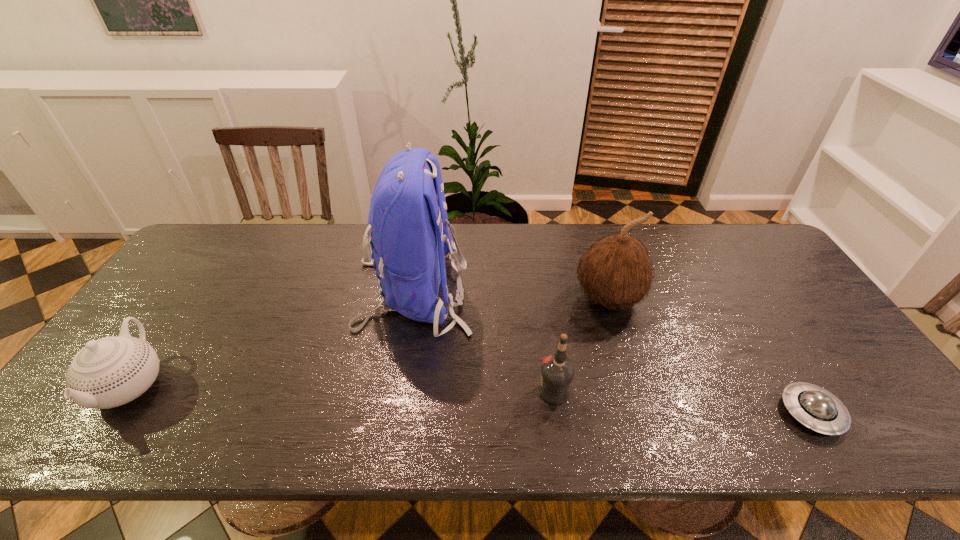
Identify the location of object located in the right edge section of the desktop. (816, 408).

Locate an element on the screen. Image resolution: width=960 pixels, height=540 pixels. object present at the near left corner is located at coordinates (109, 372).

This screenshot has height=540, width=960. What are the coordinates of `object positioned at the near right corner` in the screenshot? It's located at point(816,408).

Where is `vacant space at the far edge of the desktop`? vacant space at the far edge of the desktop is located at coordinates (541, 253).

Locate an element on the screen. This screenshot has width=960, height=540. free space at the near edge of the desktop is located at coordinates (626, 413).

Find the location of a particular element. Image resolution: width=960 pixels, height=540 pixels. blank area at the right edge is located at coordinates (812, 368).

Image resolution: width=960 pixels, height=540 pixels. In the image, there is a desktop. Identify the location of vacant space at the far left corner. (224, 245).

Identify the location of vacant position at the far right corner of the desktop. Image resolution: width=960 pixels, height=540 pixels. (721, 227).

At what (x,y) coordinates should I click in order to perform the action: click on free space between the rightmost object and the leftmost object. Please return your answer as a coordinate pair (x, y). This screenshot has height=540, width=960. Looking at the image, I should click on pyautogui.click(x=471, y=399).

Locate an element on the screen. This screenshot has height=540, width=960. unoccupied area between the rightmost object and the fourth tallest object is located at coordinates (471, 399).